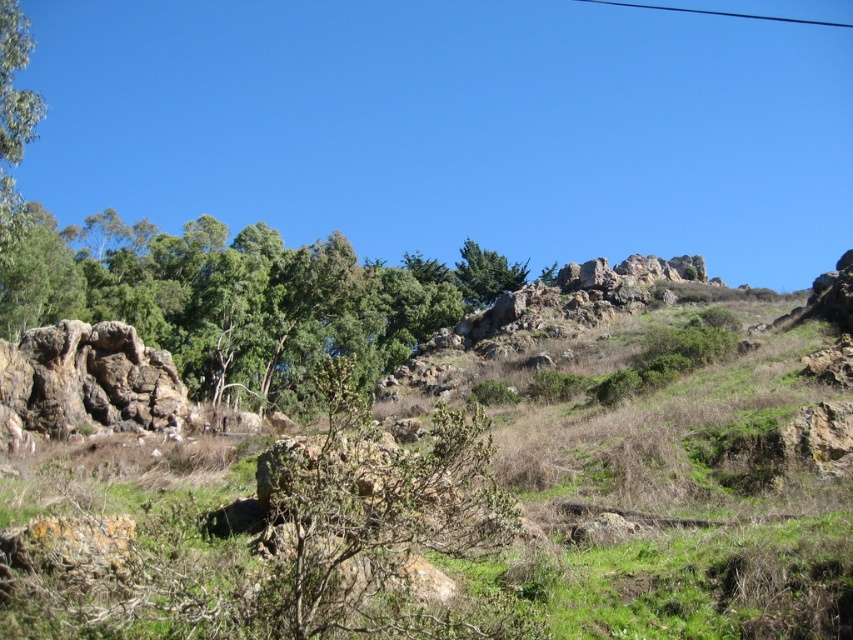
You are a hiker planning to take a photo of both the green leafy tree at upper left and the green textured tree at upper center. Which tree should you move closer to in order to capture both trees in the frame without zooming in?

You should move closer to the green leafy tree at upper left because its width is smaller than the green textured tree at upper center, allowing both to fit in the frame when positioned closer to the narrower tree.

You are a hiker planning to walk from the green rough rock at upper center to the green leafy tree at upper left. Given that your average walking pace is 1.4 meters per second, approximately how many minutes will it take you to reach the tree?

The distance between the green rough rock at upper center and the green leafy tree at upper left is 58.99 meters. At a pace of 1.4 meters per second, dividing 58.99 by 1.4 gives approximately 42.14 seconds. Converting this to minutes, it would take roughly 0.7 minutes, which is about 42 seconds.